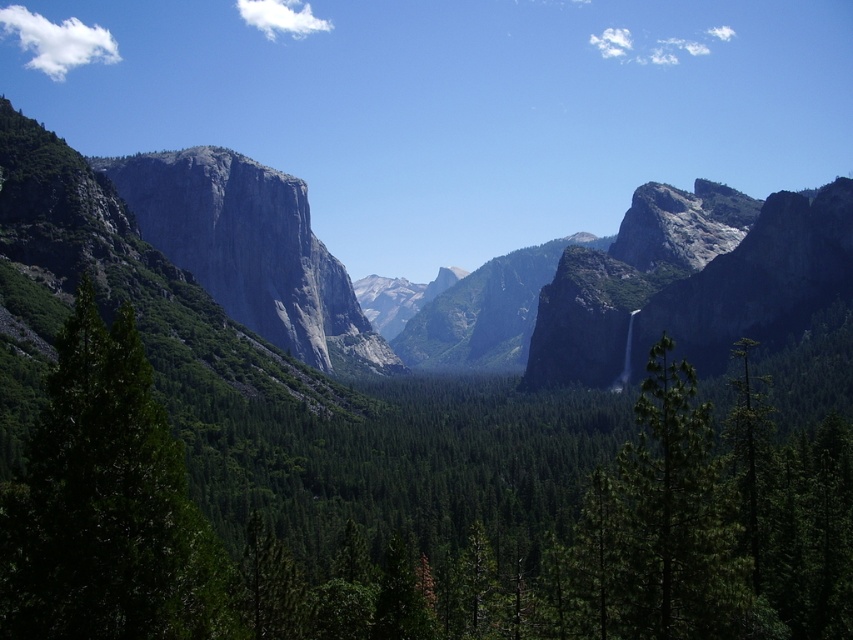
You are standing at the point marked as point (404, 540) in the image. What object is directly in front of you?

The green matte tree at center is directly in front of you at point (404, 540).

You are an environmental scientist assessing the health of the forest. You observe the green matte tree at center and the green matte tree at left. Which tree has a wider trunk?

The green matte tree at center has a wider trunk than the green matte tree at left as stated in the description.

You are a hiker standing at the edge of the valley looking towards the mountains. You see two green matte trees in your view. Which tree, the green matte tree at center or the green matte tree at left, is closer to you?

The green matte tree at center is closer to you because the green matte tree at left is behind it.